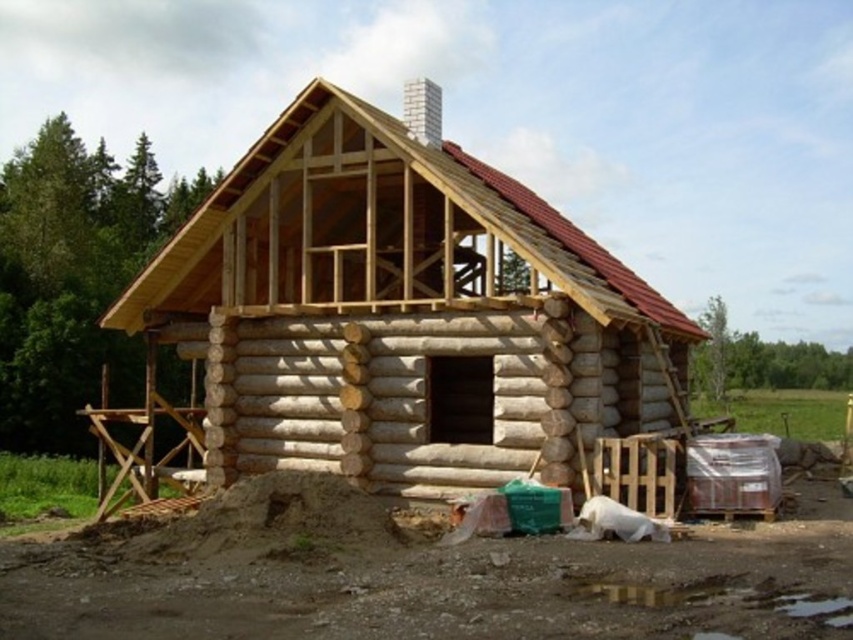
Where is the natural wood log cabin at center located in the image?

The natural wood log cabin at center is located at point [401,314].

You are standing on the brown dirt field at lower center and want to enter the natural wood log cabin at center. Which direction should you move to reach the cabin?

The natural wood log cabin at center is located above the brown dirt field at lower center, so you should move upward to reach it.